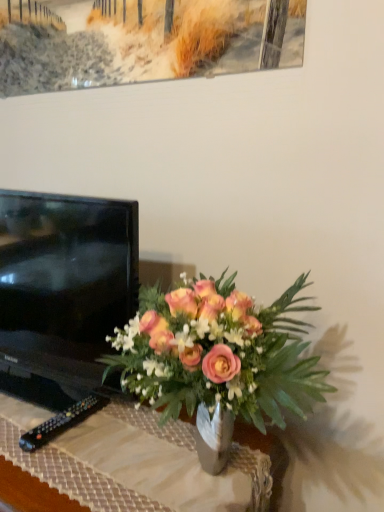
Question: Does matte glass vase at center contain black glossy tv at left?

Choices:
 (A) yes
 (B) no

Answer: (B)

Question: Is matte glass vase at center turned away from black glossy tv at left?

Choices:
 (A) no
 (B) yes

Answer: (A)

Question: Would you consider matte glass vase at center to be distant from black glossy tv at left?

Choices:
 (A) yes
 (B) no

Answer: (B)

Question: From the image's perspective, is matte glass vase at center under black glossy tv at left?

Choices:
 (A) yes
 (B) no

Answer: (A)

Question: Is matte glass vase at center smaller than black glossy tv at left?

Choices:
 (A) no
 (B) yes

Answer: (B)

Question: Is black plastic remote at lower left wider or thinner than matte glass vase at center?

Choices:
 (A) wide
 (B) thin

Answer: (B)

Question: From a real-world perspective, relative to matte glass vase at center, is black plastic remote at lower left vertically above or below?

Choices:
 (A) above
 (B) below

Answer: (A)

Question: Is black plastic remote at lower left spatially inside matte glass vase at center, or outside of it?

Choices:
 (A) inside
 (B) outside

Answer: (A)

Question: In the image, is black plastic remote at lower left positioned in front of or behind matte glass vase at center?

Choices:
 (A) front
 (B) behind

Answer: (B)

Question: From the image's perspective, is black glossy tv at left located above or below matte glass vase at center?

Choices:
 (A) above
 (B) below

Answer: (A)

Question: Considering the positions of black glossy tv at left and matte glass vase at center in the image, is black glossy tv at left bigger or smaller than matte glass vase at center?

Choices:
 (A) small
 (B) big

Answer: (B)

Question: Considering the positions of black glossy tv at left and matte glass vase at center in the image, is black glossy tv at left wider or thinner than matte glass vase at center?

Choices:
 (A) thin
 (B) wide

Answer: (A)

Question: Is point (18, 254) closer or farther from the camera than point (281, 308)?

Choices:
 (A) closer
 (B) farther

Answer: (B)

Question: Is matte glass vase at center taller or shorter than black glossy tv at left?

Choices:
 (A) tall
 (B) short

Answer: (B)

Question: Is point (236, 294) positioned closer to the camera than point (41, 337)?

Choices:
 (A) closer
 (B) farther

Answer: (A)